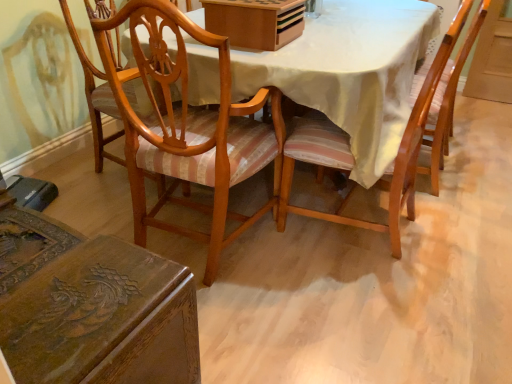
Question: From the image's perspective, is polished wood chair at lower left, which is the 1th chair from left to right, below wooden chair with striped cushion at center, placed as the second chair when sorted from left to right?

Choices:
 (A) no
 (B) yes

Answer: (B)

Question: Would you consider polished wood chair at lower left, which is the 1th chair from left to right, to be distant from wooden chair with striped cushion at center, placed as the second chair when sorted from left to right?

Choices:
 (A) no
 (B) yes

Answer: (A)

Question: From a real-world perspective, is polished wood chair at lower left, the third chair in the right-to-left sequence, below wooden chair with striped cushion at center, positioned as the 2th chair in right-to-left order?

Choices:
 (A) no
 (B) yes

Answer: (B)

Question: Can you confirm if polished wood chair at lower left, which is the 1th chair from left to right, is smaller than wooden chair with striped cushion at center, placed as the second chair when sorted from left to right?

Choices:
 (A) yes
 (B) no

Answer: (A)

Question: From the image's perspective, does polished wood chair at lower left, the third chair in the right-to-left sequence, appear higher than wooden chair with striped cushion at center, placed as the second chair when sorted from left to right?

Choices:
 (A) yes
 (B) no

Answer: (B)

Question: Visually, is polished wood chair at lower left, which is the 1th chair from left to right, positioned to the left or to the right of wooden chair with striped cushion at center, the first chair from the right?

Choices:
 (A) left
 (B) right

Answer: (A)

Question: From a real-world perspective, is polished wood chair at lower left, the third chair in the right-to-left sequence, physically located above or below wooden chair with striped cushion at center, the first chair from the right?

Choices:
 (A) below
 (B) above

Answer: (A)

Question: In the image, is polished wood chair at lower left, the third chair in the right-to-left sequence, positioned in front of or behind wooden chair with striped cushion at center, which appears as the third chair when viewed from the left?

Choices:
 (A) front
 (B) behind

Answer: (A)

Question: Is polished wood chair at lower left, which is the 1th chair from left to right, inside or outside of wooden chair with striped cushion at center, the first chair from the right?

Choices:
 (A) outside
 (B) inside

Answer: (A)

Question: Is wooden box at upper center taller or shorter than wooden chair with striped cushion at center, which appears as the third chair when viewed from the left?

Choices:
 (A) tall
 (B) short

Answer: (B)

Question: Based on their positions, is wooden box at upper center located to the left or right of wooden chair with striped cushion at center, which appears as the third chair when viewed from the left?

Choices:
 (A) left
 (B) right

Answer: (A)

Question: Considering the positions of wooden box at upper center and wooden chair with striped cushion at center, the first chair from the right, in the image, is wooden box at upper center bigger or smaller than wooden chair with striped cushion at center, the first chair from the right,?

Choices:
 (A) big
 (B) small

Answer: (B)

Question: Is point (219, 24) positioned closer to the camera than point (331, 215)?

Choices:
 (A) farther
 (B) closer

Answer: (B)

Question: Considering the positions of wooden chair with striped cushion at center, which appears as the third chair when viewed from the left, and wooden chair with striped cushion at center, placed as the second chair when sorted from left to right, in the image, is wooden chair with striped cushion at center, which appears as the third chair when viewed from the left, bigger or smaller than wooden chair with striped cushion at center, placed as the second chair when sorted from left to right,?

Choices:
 (A) small
 (B) big

Answer: (A)

Question: Is wooden chair with striped cushion at center, which appears as the third chair when viewed from the left, wider or thinner than wooden chair with striped cushion at center, placed as the second chair when sorted from left to right?

Choices:
 (A) wide
 (B) thin

Answer: (A)